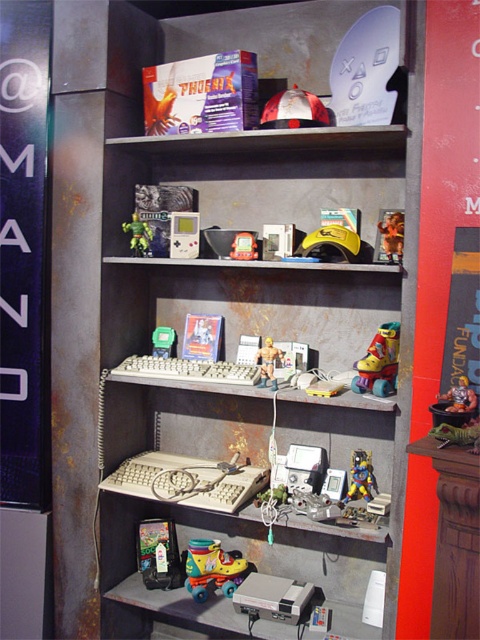
Does yellow rubber roller skates at center appear under metallic plastic action figure at lower right?

Incorrect, yellow rubber roller skates at center is not positioned below metallic plastic action figure at lower right.

What do you see at coordinates (379, 362) in the screenshot? This screenshot has width=480, height=640. I see `yellow rubber roller skates at center` at bounding box center [379, 362].

Find the location of a particular element. This screenshot has width=480, height=640. yellow rubber roller skates at center is located at coordinates (379, 362).

Is point (359, 385) farther from camera compared to point (279, 358)?

No, it is not.

Between yellow rubber roller skates at center and metallic silver action figure at center, which one has less height?

With less height is metallic silver action figure at center.

Does point (364, 362) come in front of point (263, 376)?

Yes.

This screenshot has height=640, width=480. In order to click on yellow rubber roller skates at center in this screenshot , I will do `click(379, 362)`.

Find the location of a particular element. shiny plastic game console at center is located at coordinates (243, 246).

Between point (253, 252) and point (158, 348), which one is positioned behind?

Positioned behind is point (158, 348).

Identify the location of shiny plastic game console at center. (243, 246).